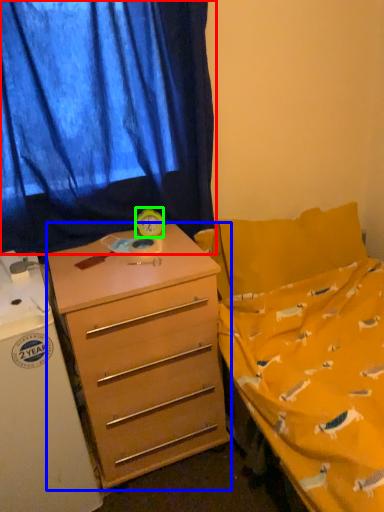
Question: Which is nearer to the curtain (highlighted by a red box)? desk (highlighted by a blue box) or clock (highlighted by a green box).

Choices:
 (A) desk
 (B) clock

Answer: (B)